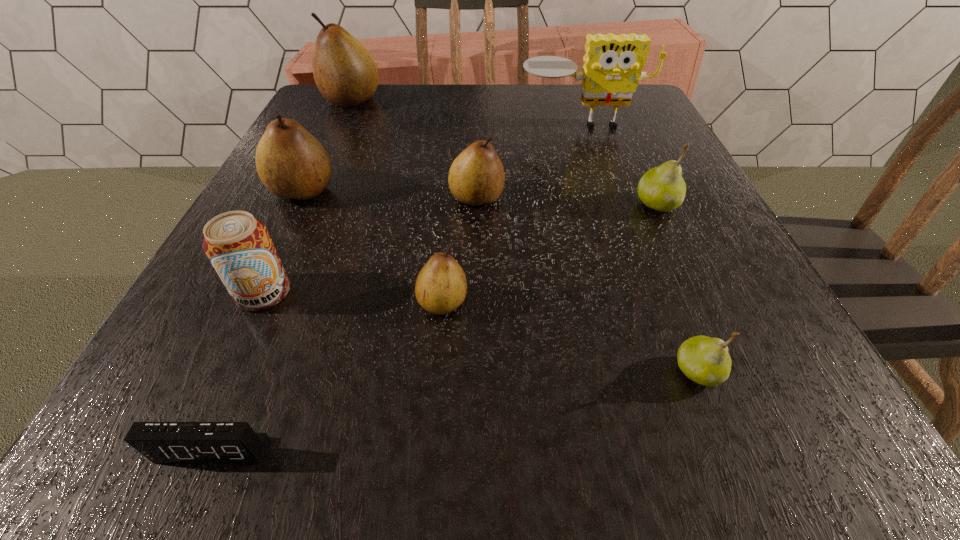
Locate an element on the screen. Image resolution: width=960 pixels, height=540 pixels. free space located 0.280m on the back of the nearer green pear is located at coordinates (636, 217).

At what (x,y) coordinates should I click in order to perform the action: click on pear situated at the far edge. Please return your answer as a coordinate pair (x, y). This screenshot has width=960, height=540. Looking at the image, I should click on (345, 73).

Find the location of a particular element. sponge that is at the far edge is located at coordinates (612, 68).

Identify the location of object that is at the near edge. The image size is (960, 540). (160, 442).

Where is `beer can that is at the left edge`? The width and height of the screenshot is (960, 540). beer can that is at the left edge is located at coordinates (239, 247).

Where is `alarm clock that is at the left edge`? alarm clock that is at the left edge is located at coordinates (160, 442).

I want to click on sponge that is at the right edge, so click(x=612, y=68).

Image resolution: width=960 pixels, height=540 pixels. Find the location of `object located in the far left corner section of the desktop`. object located in the far left corner section of the desktop is located at coordinates (345, 73).

The width and height of the screenshot is (960, 540). I want to click on object that is at the near left corner, so click(x=160, y=442).

The height and width of the screenshot is (540, 960). I want to click on object that is positioned at the far right corner, so click(x=612, y=68).